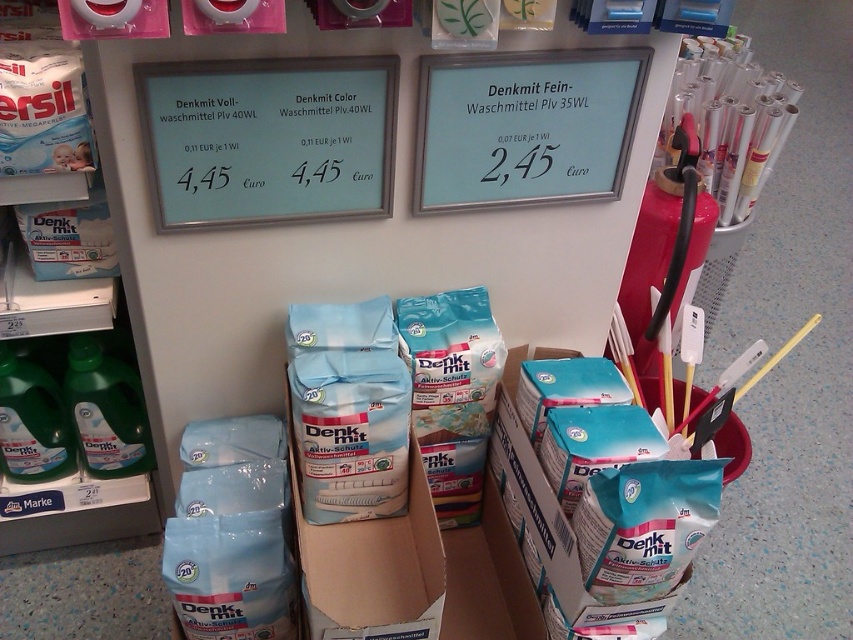
You are a customer in the store and want to reach the point at coordinates point (223, 189) and point (549, 104). Which point do you need to walk towards first if you want to reach them in the order they appear from your current position?

You should first walk towards point (223, 189) because it is in front of point (549, 104), meaning it is closer to your current position.

You are organizing a store shelf and need to place the translucent green bottle at left and the green plastic bottle at lower left next to each other. Which bottle should you place on the left side to ensure they fit properly?

The translucent green bottle at left has a lesser width compared to the green plastic bottle at lower right. To ensure they fit properly, place the narrower translucent green bottle at left on the left side and the wider green plastic bottle at lower left on the right side.

From the picture: You are a customer in the store looking for laundry detergent. You see a translucent green bottle at left and a green plastic bottle at lower left. Which one is positioned more to the right?

The translucent green bottle at left is positioned more to the right compared to the green plastic bottle at lower left.